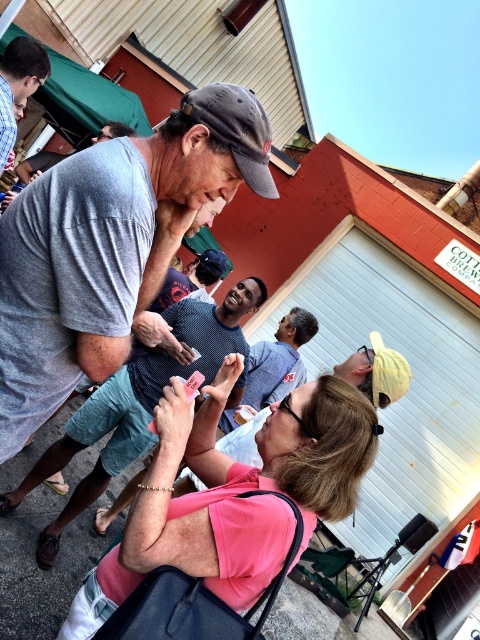
You are standing in the scene and want to pick up both the matte black phone at center and the matte gray shirt at center. Which object should you reach for first to grab the one closer to you?

The matte black phone at center is closer to you than the matte gray shirt at center, so you should reach for the matte black phone at center first.

You are at a community event and see a woman in a pink matte shirt at center and a matte black phone at center. Which object is wider?

The matte black phone at center is wider than the pink matte shirt at center.